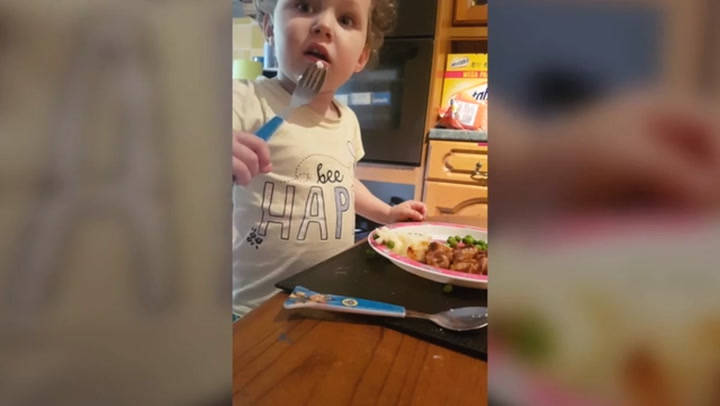
This screenshot has width=720, height=406. I want to click on placemat, so click(351, 270).